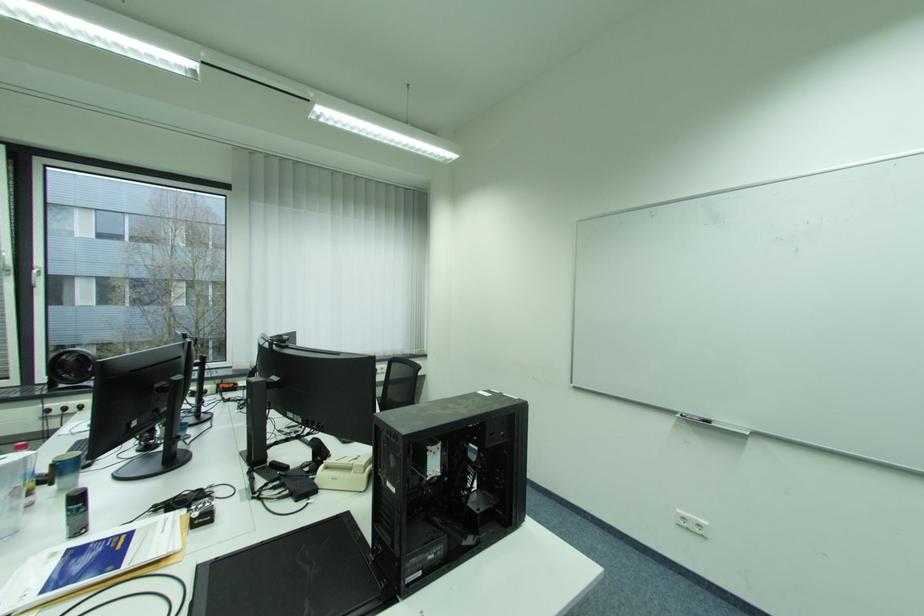
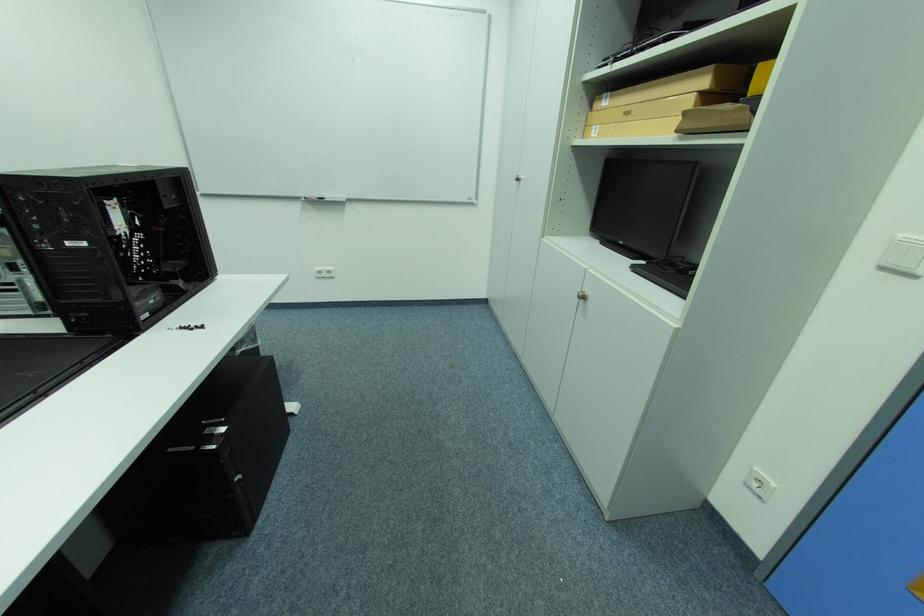
Locate, in the second image, the point that corresponds to (715,422) in the first image.

(331, 199)